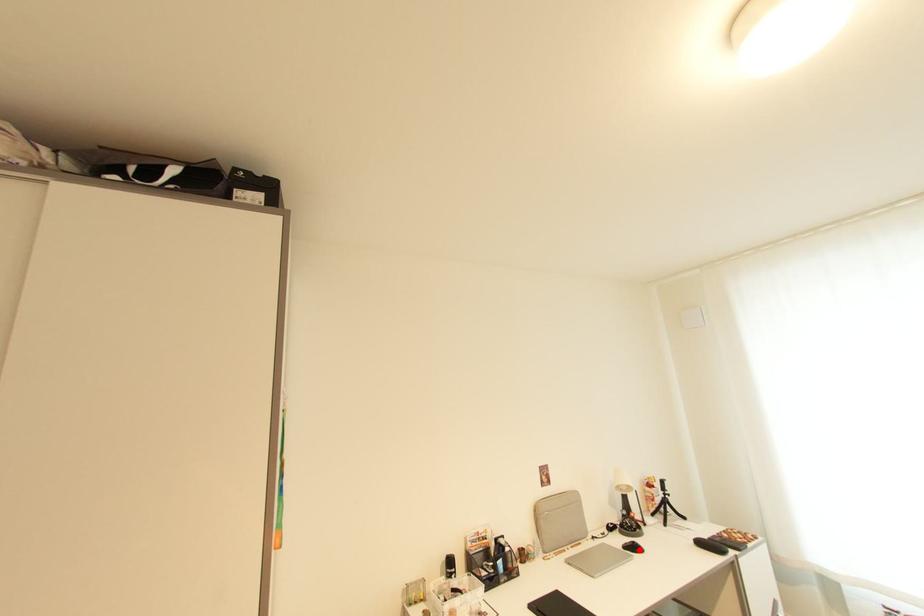
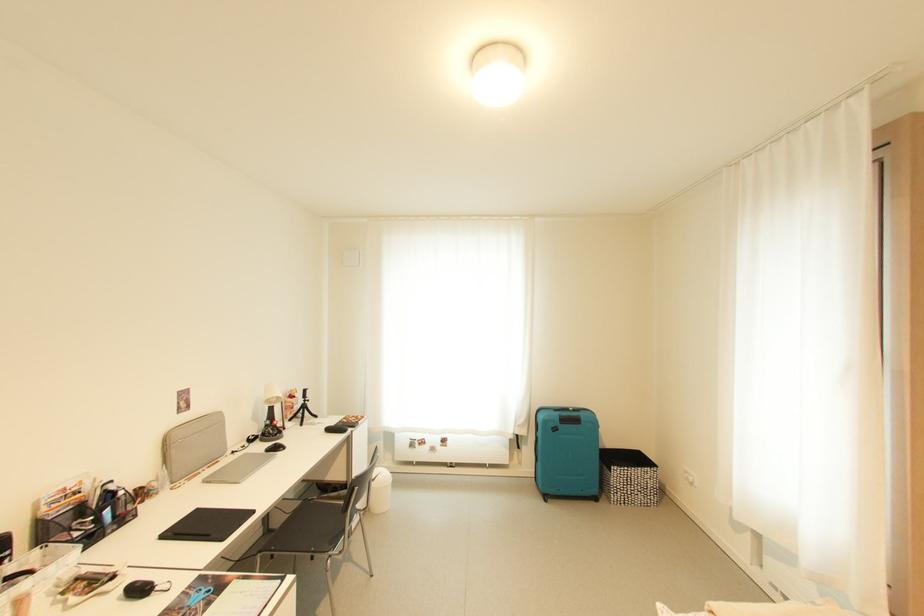
Find the pixel in the second image that matches the highlighted location in the first image.

(282, 450)